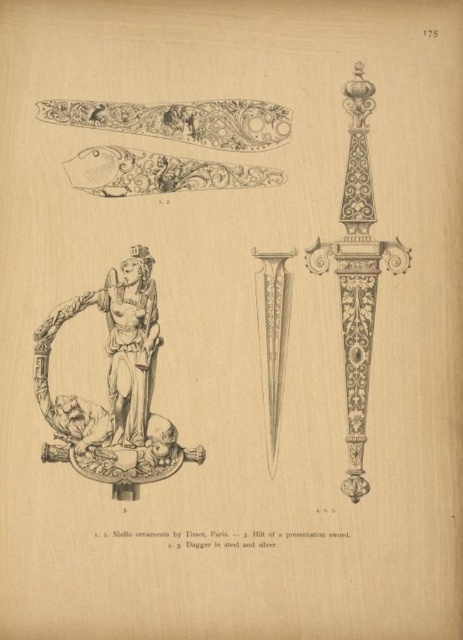
Between etched silver dagger at center and polished silver dagger at center, which one appears on the left side from the viewer's perspective?

Positioned to the left is polished silver dagger at center.

Measure the distance between point (346, 349) and camera.

They are 96.31 meters apart.

This screenshot has width=463, height=640. Find the location of `etched silver dagger at center`. etched silver dagger at center is located at coordinates (357, 273).

Describe the element at coordinates (114, 388) in the screenshot. The width and height of the screenshot is (463, 640). I see `polished bronze statue at center` at that location.

Does point (137, 289) come closer to viewer compared to point (274, 275)?

Yes, it is.

Find the location of a particular element. The height and width of the screenshot is (640, 463). polished bronze statue at center is located at coordinates (114, 388).

Identify the location of polished bronze statue at center. (114, 388).

Can you confirm if polished bronze statue at center is shorter than etched silver dagger at center?

Yes, polished bronze statue at center is shorter than etched silver dagger at center.

Who is more forward, [135,403] or [356,308]?

Point [135,403] is in front.

The width and height of the screenshot is (463, 640). Find the location of `polished bronze statue at center`. polished bronze statue at center is located at coordinates (114, 388).